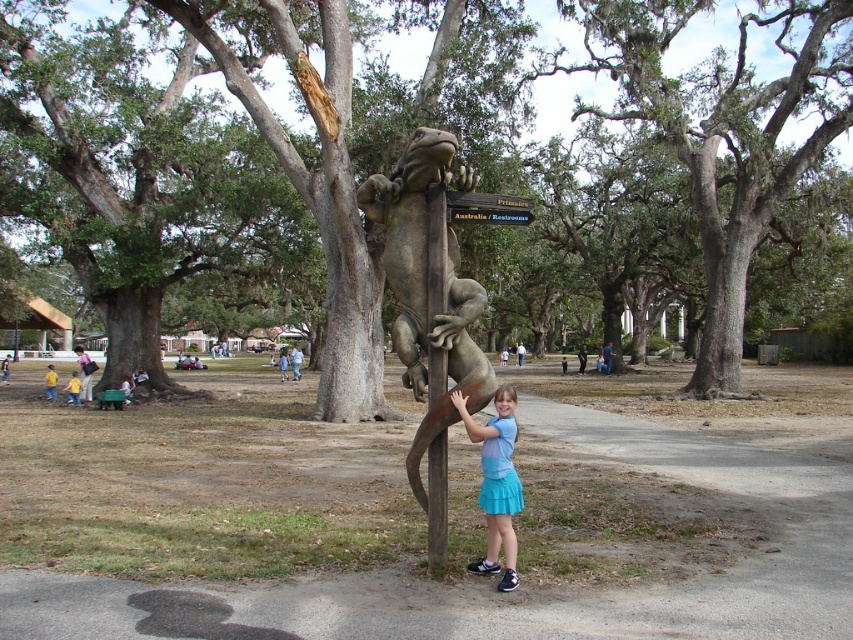
Consider the image. You are a visitor at the park and see the bronze textured lizard at center and the yellow shirt at lower left. Which object is located higher in the image?

The bronze textured lizard at center is positioned over the yellow shirt at lower left, meaning it is higher up in the image.

You are a park visitor holding a 2 meter long ladder. You need to place it between the green mossy tree at center and the wooden sign at center. Can you fit the ladder horizontally between them without bending it?

The green mossy tree at center might be wider than wooden sign at center, so the distance between them is uncertain. Therefore, it is unclear if the 2 meter ladder can fit horizontally between them without bending it.

You are standing in the park and see the smooth gray lizard at center and the yellow shirt at lower left. Which object is higher up from the ground?

The smooth gray lizard at center is located above the yellow shirt at lower left, so it is higher up from the ground.